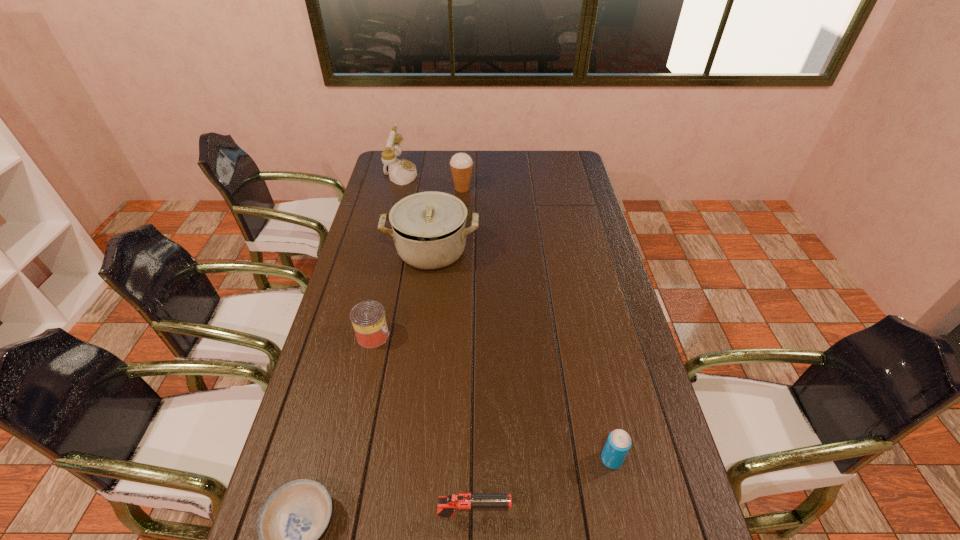
Image resolution: width=960 pixels, height=540 pixels. I want to click on vacant space at the left edge of the desktop, so click(362, 272).

Locate an element on the screen. vacant space at the right edge is located at coordinates (631, 387).

Locate an element on the screen. The height and width of the screenshot is (540, 960). free spot between the gun and the icecream is located at coordinates (468, 352).

Locate an element on the screen. This screenshot has height=540, width=960. free spot between the gun and the soda can is located at coordinates (542, 487).

Find the location of `free space between the fourth farthest object and the telephone`. free space between the fourth farthest object and the telephone is located at coordinates (387, 254).

Locate an element on the screen. vacant space in between the gun and the icecream is located at coordinates (468, 352).

Find the location of a particular element. unoccupied area between the third nearest object and the telephone is located at coordinates [506, 316].

Locate which object is the second closest to the telephone. Please provide its 2D coordinates. Your answer should be formatted as a tuple, i.e. [(x, y)], where the tuple contains the x and y coordinates of a point satisfying the conditions above.

[(429, 230)]

Identify which object is the nearest to the gun. Please provide its 2D coordinates. Your answer should be formatted as a tuple, i.e. [(x, y)], where the tuple contains the x and y coordinates of a point satisfying the conditions above.

[(294, 517)]

The height and width of the screenshot is (540, 960). Identify the location of vacant point that satisfies the following two spatial constraints: 1. on the dial of the saucepan; 2. on the right side of the telephone. (381, 251).